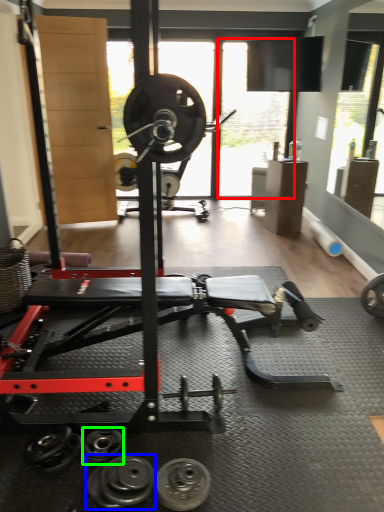
Question: Estimate the real-world distances between objects in this image. Which object is farther from window screen (highlighted by a red box), dumbbell (highlighted by a blue box) or dumbbell (highlighted by a green box)?

Choices:
 (A) dumbbell
 (B) dumbbell

Answer: (A)